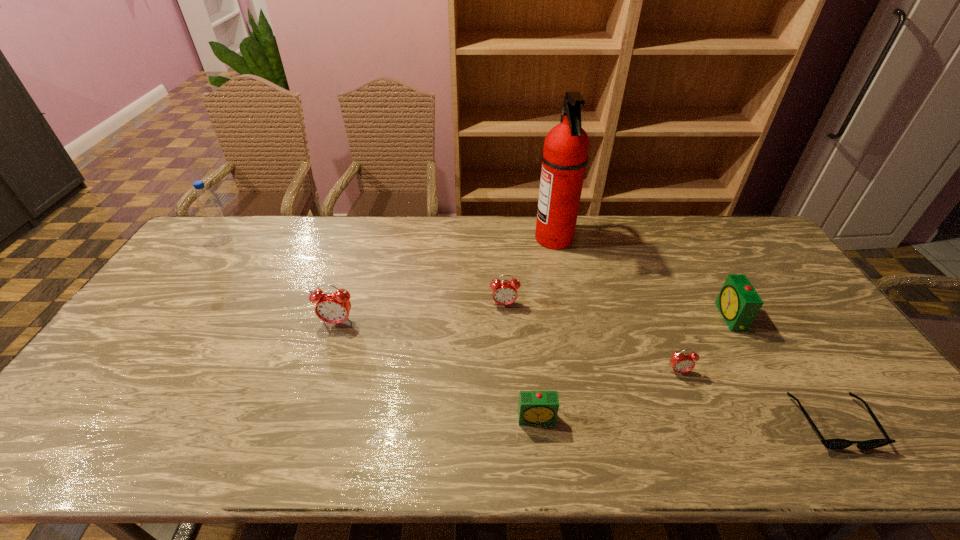
The width and height of the screenshot is (960, 540). What are the coordinates of `the tallest object` in the screenshot? It's located at (565, 156).

You are a GUI agent. You are given a task and a screenshot of the screen. Output one action in this format:
    pyautogui.click(x=<x>, y=<y>)
    Task: Click on the fourth object from right to left
    
    Given the screenshot: What is the action you would take?
    pyautogui.click(x=565, y=156)

Locate an element on the screen. the seventh shortest object is located at coordinates (220, 231).

Where is `the leftmost object`? Image resolution: width=960 pixels, height=540 pixels. the leftmost object is located at coordinates (220, 231).

I want to click on the leftmost red alarm clock, so click(x=332, y=307).

I want to click on the biggest red alarm clock, so pyautogui.click(x=332, y=307).

The width and height of the screenshot is (960, 540). I want to click on the farthest red alarm clock, so click(504, 292).

I want to click on the second biggest red alarm clock, so click(x=504, y=292).

The height and width of the screenshot is (540, 960). Find the location of `the rightmost alarm clock`. the rightmost alarm clock is located at coordinates (738, 302).

Where is `the farther green alarm clock`? The image size is (960, 540). the farther green alarm clock is located at coordinates (738, 302).